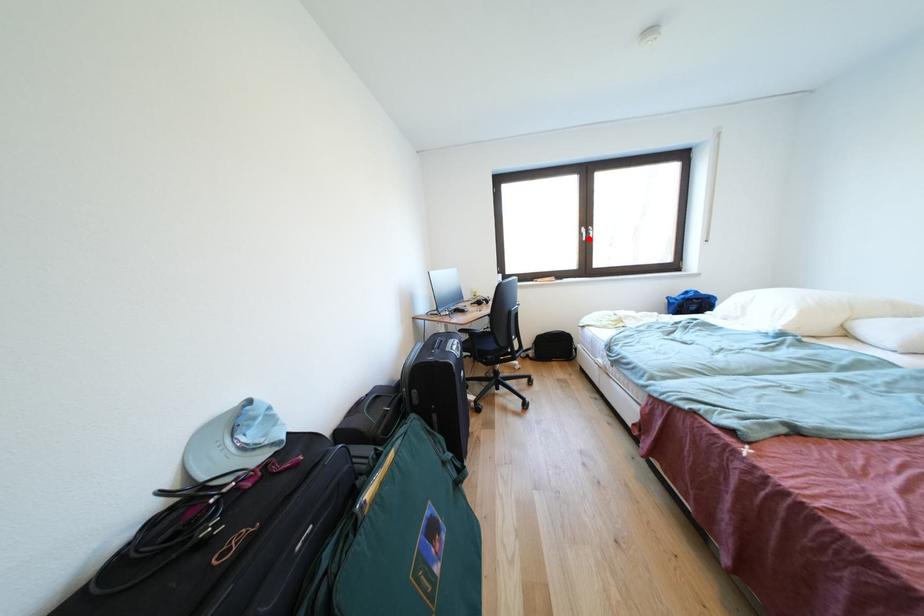
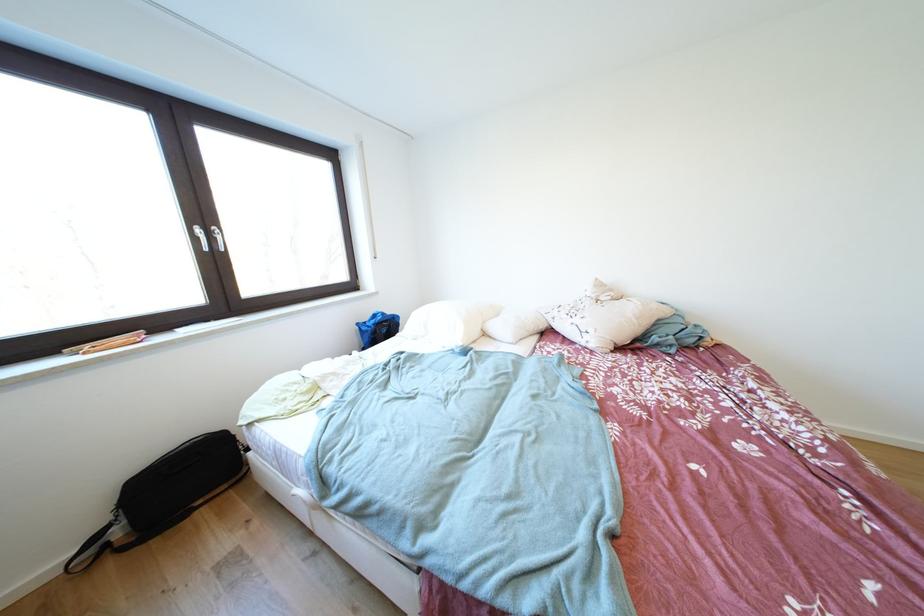
Find the pixel in the second image that matches the highlighted location in the first image.

(203, 244)